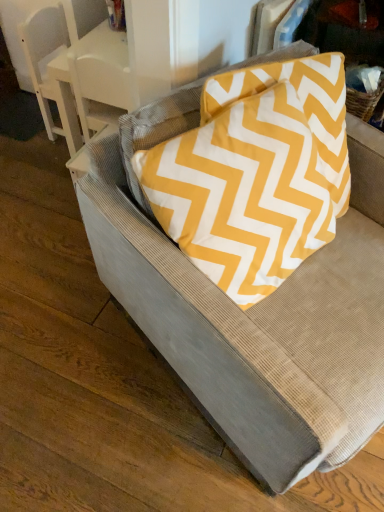
Locate an element on the screen. free location to the left of white glossy table at upper left is located at coordinates (51, 165).